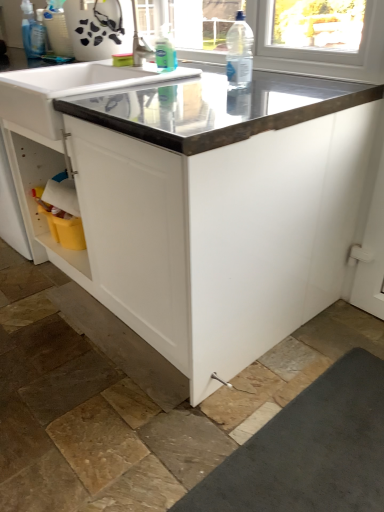
In order to face metallic gray countertop at center, should I rotate leftwards or rightwards?

Turn left approximately 3.437 degrees to face it.

How much space does translucent plastic spray bottle at upper left, which appears as the first cleaning product when viewed from the back, occupy vertically?

translucent plastic spray bottle at upper left, which appears as the first cleaning product when viewed from the back, is 10.98 inches in height.

This screenshot has height=512, width=384. I want to click on white glossy sink at upper center, so click(x=68, y=89).

Locate an element on the screen. The image size is (384, 512). metallic gray countertop at center is located at coordinates (208, 209).

Is point (47, 92) positioned behind point (79, 103)?

Yes, it is.

Is white glossy sink at upper center wider than metallic gray countertop at center?

Incorrect, the width of white glossy sink at upper center does not surpass that of metallic gray countertop at center.

From a real-world perspective, between white glossy sink at upper center and metallic gray countertop at center, who is vertically higher?

In real-world perspective, white glossy sink at upper center is above.

Between white glossy sink at upper center and metallic gray countertop at center, which one has larger size?

Bigger between the two is metallic gray countertop at center.

Based on the photo, are clear plastic bottle at upper center and white glossy sink at upper center located far from each other?

That's not correct — clear plastic bottle at upper center is a little close to white glossy sink at upper center.

Is clear plastic bottle at upper center oriented towards white glossy sink at upper center?

No, clear plastic bottle at upper center is not aimed at white glossy sink at upper center.

Can you tell me how much clear plastic bottle at upper center and white glossy sink at upper center differ in facing direction?

The facing directions of clear plastic bottle at upper center and white glossy sink at upper center are 0.811 degrees apart.

In the scene shown: Which of these two, clear plastic bottle at upper center or white glossy sink at upper center, is bigger?

white glossy sink at upper center.

Is translucent plastic spray bottle at upper left, the second cleaning product in the front-to-back sequence, positioned with its back to metallic gray countertop at center?

No, translucent plastic spray bottle at upper left, the second cleaning product in the front-to-back sequence, is not facing away from metallic gray countertop at center.

Looking at this image, is translucent plastic spray bottle at upper left, the second cleaning product in the front-to-back sequence, completely or partially outside of metallic gray countertop at center?

translucent plastic spray bottle at upper left, the second cleaning product in the front-to-back sequence, lies outside metallic gray countertop at center's area.

From the image's perspective, is translucent plastic spray bottle at upper left, which ranks as the second cleaning product in right-to-left order, above or below metallic gray countertop at center?

translucent plastic spray bottle at upper left, which ranks as the second cleaning product in right-to-left order, is above metallic gray countertop at center.

Does point (161, 30) appear closer or farther from the camera than point (238, 28)?

Clearly, point (161, 30) is more distant from the camera than point (238, 28).

Consider the image. Is translucent plastic bottle at upper center, marked as the first cleaning product in a front-to-back arrangement, next to clear plastic bottle at upper center?

No.

Does translucent plastic bottle at upper center, marked as the first cleaning product in a front-to-back arrangement, have a greater height compared to clear plastic bottle at upper center?

No, translucent plastic bottle at upper center, marked as the first cleaning product in a front-to-back arrangement, is not taller than clear plastic bottle at upper center.

Is white glossy sink at upper center behind translucent plastic bottle at upper center, the second cleaning product positioned from the left?

No, it is not.

How far apart are white glossy sink at upper center and translucent plastic bottle at upper center, which is counted as the second cleaning product, starting from the top?

A distance of 13.26 inches exists between white glossy sink at upper center and translucent plastic bottle at upper center, which is counted as the second cleaning product, starting from the top.

From the image's perspective, which object appears higher, white glossy sink at upper center or translucent plastic bottle at upper center, marked as the first cleaning product in a front-to-back arrangement?

From the image's view, translucent plastic bottle at upper center, marked as the first cleaning product in a front-to-back arrangement, is above.

Is white glossy sink at upper center placed right next to translucent plastic bottle at upper center, marked as the first cleaning product in a front-to-back arrangement?

No, white glossy sink at upper center is not making contact with translucent plastic bottle at upper center, marked as the first cleaning product in a front-to-back arrangement.

Considering the sizes of translucent plastic bottle at upper center, marked as the first cleaning product in a front-to-back arrangement, and translucent plastic spray bottle at upper left, which ranks as the second cleaning product in right-to-left order, in the image, is translucent plastic bottle at upper center, marked as the first cleaning product in a front-to-back arrangement, taller or shorter than translucent plastic spray bottle at upper left, which ranks as the second cleaning product in right-to-left order,?

translucent plastic bottle at upper center, marked as the first cleaning product in a front-to-back arrangement, is shorter than translucent plastic spray bottle at upper left, which ranks as the second cleaning product in right-to-left order.

Is translucent plastic bottle at upper center, which is counted as the second cleaning product, starting from the top, wider than translucent plastic spray bottle at upper left, the second cleaning product in the front-to-back sequence?

Yes.

Is translucent plastic bottle at upper center, marked as the first cleaning product in a front-to-back arrangement, positioned with its back to translucent plastic spray bottle at upper left, the second cleaning product in the front-to-back sequence?

No, translucent plastic bottle at upper center, marked as the first cleaning product in a front-to-back arrangement,'s orientation is not away from translucent plastic spray bottle at upper left, the second cleaning product in the front-to-back sequence.

Looking at this image, looking at the image, does translucent plastic bottle at upper center, marked as the first cleaning product in a front-to-back arrangement, seem bigger or smaller compared to translucent plastic spray bottle at upper left, arranged as the second cleaning product when ordered from the bottom?

In the image, translucent plastic bottle at upper center, marked as the first cleaning product in a front-to-back arrangement, appears to be smaller than translucent plastic spray bottle at upper left, arranged as the second cleaning product when ordered from the bottom.

Between metallic gray countertop at center and clear plastic bottle at upper center, which one has smaller width?

clear plastic bottle at upper center is thinner.

Between metallic gray countertop at center and clear plastic bottle at upper center, which one is positioned behind?

clear plastic bottle at upper center is further from the camera.

Is metallic gray countertop at center with clear plastic bottle at upper center?

metallic gray countertop at center is not next to clear plastic bottle at upper center, and they're not touching.

From the image's perspective, is metallic gray countertop at center positioned above or below clear plastic bottle at upper center?

Clearly, from the image's perspective, metallic gray countertop at center is below clear plastic bottle at upper center.

Find the location of `sink positioned vertically above the metallic gray countertop at center (from a real-world perspective)`. sink positioned vertically above the metallic gray countertop at center (from a real-world perspective) is located at coordinates (68, 89).

The height and width of the screenshot is (512, 384). Find the location of `bottle on the right of white glossy sink at upper center`. bottle on the right of white glossy sink at upper center is located at coordinates (239, 52).

When comparing their distances from metallic gray countertop at center, does translucent plastic spray bottle at upper left, which ranks as the first cleaning product in left-to-right order, or white glossy sink at upper center seem closer?

Based on the image, white glossy sink at upper center appears to be nearer to metallic gray countertop at center.

From the image, which object appears to be nearer to white glossy sink at upper center, translucent plastic bottle at upper center, marked as the first cleaning product in a front-to-back arrangement, or translucent plastic spray bottle at upper left, arranged as the first cleaning product when viewed from the top?

Among the two, translucent plastic bottle at upper center, marked as the first cleaning product in a front-to-back arrangement, is located nearer to white glossy sink at upper center.

Which object lies further to the anchor point clear plastic bottle at upper center, white glossy sink at upper center or metallic gray countertop at center?

metallic gray countertop at center lies further to clear plastic bottle at upper center than the other object.

When comparing their distances from white glossy sink at upper center, does translucent plastic spray bottle at upper left, arranged as the second cleaning product when ordered from the bottom, or translucent plastic bottle at upper center, the 2th cleaning product in the back-to-front sequence, seem closer?

translucent plastic bottle at upper center, the 2th cleaning product in the back-to-front sequence.

From the picture: Considering their positions, is white glossy sink at upper center positioned further to translucent plastic bottle at upper center, marked as the first cleaning product in a front-to-back arrangement, than metallic gray countertop at center?

Based on the image, metallic gray countertop at center appears to be further to translucent plastic bottle at upper center, marked as the first cleaning product in a front-to-back arrangement.

Estimate the real-world distances between objects in this image. Which object is closer to metallic gray countertop at center, white glossy sink at upper center or translucent plastic bottle at upper center, the 2th cleaning product in the back-to-front sequence?

Based on the image, white glossy sink at upper center appears to be nearer to metallic gray countertop at center.

Considering their positions, is clear plastic bottle at upper center positioned further to metallic gray countertop at center than translucent plastic bottle at upper center, the 2th cleaning product in the back-to-front sequence?

translucent plastic bottle at upper center, the 2th cleaning product in the back-to-front sequence, is positioned further to the anchor metallic gray countertop at center.

Considering their positions, is clear plastic bottle at upper center positioned closer to translucent plastic spray bottle at upper left, arranged as the second cleaning product when ordered from the bottom, than metallic gray countertop at center?

Among the two, clear plastic bottle at upper center is located nearer to translucent plastic spray bottle at upper left, arranged as the second cleaning product when ordered from the bottom.

I want to click on countertop located between white glossy sink at upper center and clear plastic bottle at upper center in the left-right direction, so click(x=208, y=209).

Locate an element on the screen. The height and width of the screenshot is (512, 384). sink positioned between metallic gray countertop at center and translucent plastic bottle at upper center, marked as the 1th cleaning product in a right-to-left arrangement, from near to far is located at coordinates (68, 89).

Locate an element on the screen. cleaning product located between white glossy sink at upper center and translucent plastic spray bottle at upper left, which appears as the first cleaning product when viewed from the back, in the depth direction is located at coordinates (165, 50).

Image resolution: width=384 pixels, height=512 pixels. What are the coordinates of `sink located between translucent plastic spray bottle at upper left, arranged as the first cleaning product when viewed from the top, and clear plastic bottle at upper center in the left-right direction` in the screenshot? It's located at (68, 89).